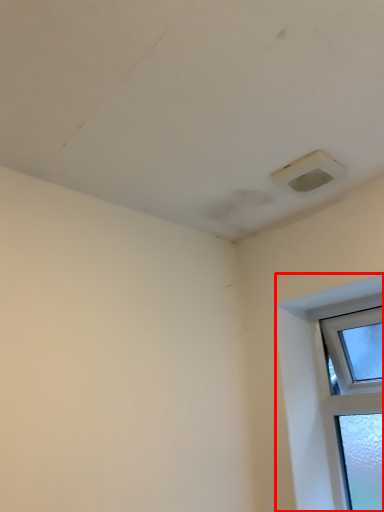
Question: From the image, what is the correct spatial relationship of window (annotated by the red box) in relation to air conditioning?

Choices:
 (A) left
 (B) right

Answer: (B)